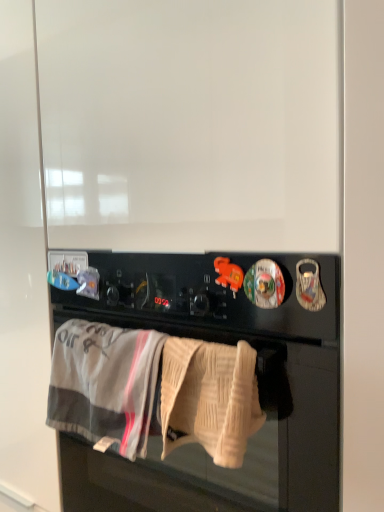
Question: From the image's perspective, does beige knitted towel at lower center, marked as the first bath towel in a right-to-left arrangement, appear higher than black matte oven at center?

Choices:
 (A) yes
 (B) no

Answer: (A)

Question: Considering the relative positions of beige knitted towel at lower center, marked as the first bath towel in a right-to-left arrangement, and black matte oven at center in the image provided, is beige knitted towel at lower center, marked as the first bath towel in a right-to-left arrangement, to the right of black matte oven at center from the viewer's perspective?

Choices:
 (A) yes
 (B) no

Answer: (B)

Question: Is beige knitted towel at lower center, marked as the first bath towel in a right-to-left arrangement, not within black matte oven at center?

Choices:
 (A) yes
 (B) no

Answer: (A)

Question: Is beige knitted towel at lower center, which is the 2th bath towel from left to right, to the left of black matte oven at center from the viewer's perspective?

Choices:
 (A) yes
 (B) no

Answer: (A)

Question: Can you confirm if beige knitted towel at lower center, marked as the first bath towel in a right-to-left arrangement, is smaller than black matte oven at center?

Choices:
 (A) yes
 (B) no

Answer: (A)

Question: Based on their sizes in the image, would you say gray cotton bath towel at lower center, positioned as the first bath towel in left-to-right order, is bigger or smaller than black matte oven at center?

Choices:
 (A) big
 (B) small

Answer: (B)

Question: Is gray cotton bath towel at lower center, which is the 2th bath towel from right to left, situated inside black matte oven at center or outside?

Choices:
 (A) outside
 (B) inside

Answer: (A)

Question: From the image's perspective, is gray cotton bath towel at lower center, positioned as the first bath towel in left-to-right order, above or below black matte oven at center?

Choices:
 (A) below
 (B) above

Answer: (B)

Question: Is gray cotton bath towel at lower center, positioned as the first bath towel in left-to-right order, to the left or to the right of black matte oven at center in the image?

Choices:
 (A) right
 (B) left

Answer: (B)

Question: From the image's perspective, is gray cotton bath towel at lower center, which is the 2th bath towel from right to left, positioned above or below beige knitted towel at lower center, marked as the first bath towel in a right-to-left arrangement?

Choices:
 (A) above
 (B) below

Answer: (B)

Question: Based on their sizes in the image, would you say gray cotton bath towel at lower center, positioned as the first bath towel in left-to-right order, is bigger or smaller than beige knitted towel at lower center, marked as the first bath towel in a right-to-left arrangement?

Choices:
 (A) small
 (B) big

Answer: (B)

Question: Looking at their shapes, would you say gray cotton bath towel at lower center, positioned as the first bath towel in left-to-right order, is wider or thinner than beige knitted towel at lower center, which is the 2th bath towel from left to right?

Choices:
 (A) thin
 (B) wide

Answer: (B)

Question: Considering the relative positions of gray cotton bath towel at lower center, positioned as the first bath towel in left-to-right order, and beige knitted towel at lower center, which is the 2th bath towel from left to right, in the image provided, is gray cotton bath towel at lower center, positioned as the first bath towel in left-to-right order, to the left or to the right of beige knitted towel at lower center, which is the 2th bath towel from left to right,?

Choices:
 (A) right
 (B) left

Answer: (B)

Question: In the image, is black matte oven at center on the left side or the right side of beige knitted towel at lower center, marked as the first bath towel in a right-to-left arrangement?

Choices:
 (A) left
 (B) right

Answer: (B)

Question: From a real-world perspective, relative to beige knitted towel at lower center, which is the 2th bath towel from left to right, is black matte oven at center vertically above or below?

Choices:
 (A) below
 (B) above

Answer: (A)